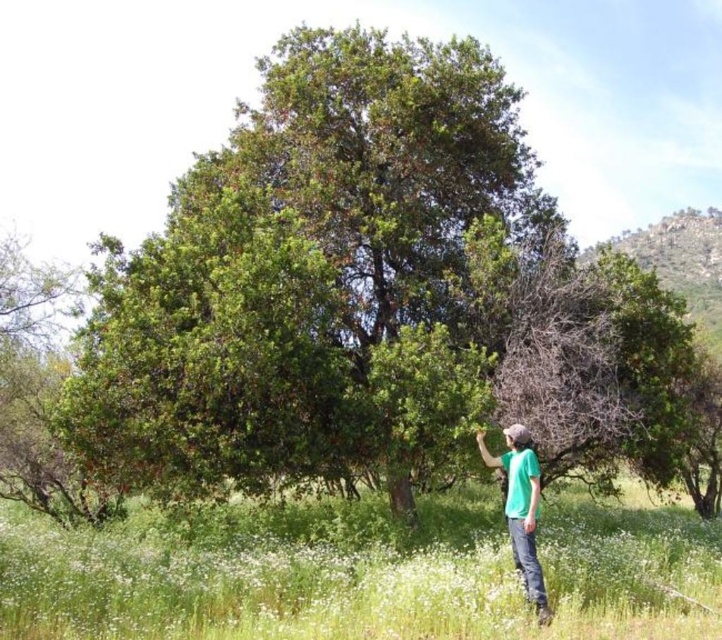
Question: Does green soft grass at lower center have a larger size compared to green matte shirt at lower right?

Choices:
 (A) no
 (B) yes

Answer: (B)

Question: Which of the following is the closest to the observer?

Choices:
 (A) (523, 504)
 (B) (645, 627)

Answer: (B)

Question: Considering the relative positions of green soft grass at lower center and green matte shirt at lower right in the image provided, where is green soft grass at lower center located with respect to green matte shirt at lower right?

Choices:
 (A) above
 (B) below

Answer: (B)

Question: Is green soft grass at lower center in front of green matte shirt at lower right?

Choices:
 (A) yes
 (B) no

Answer: (A)